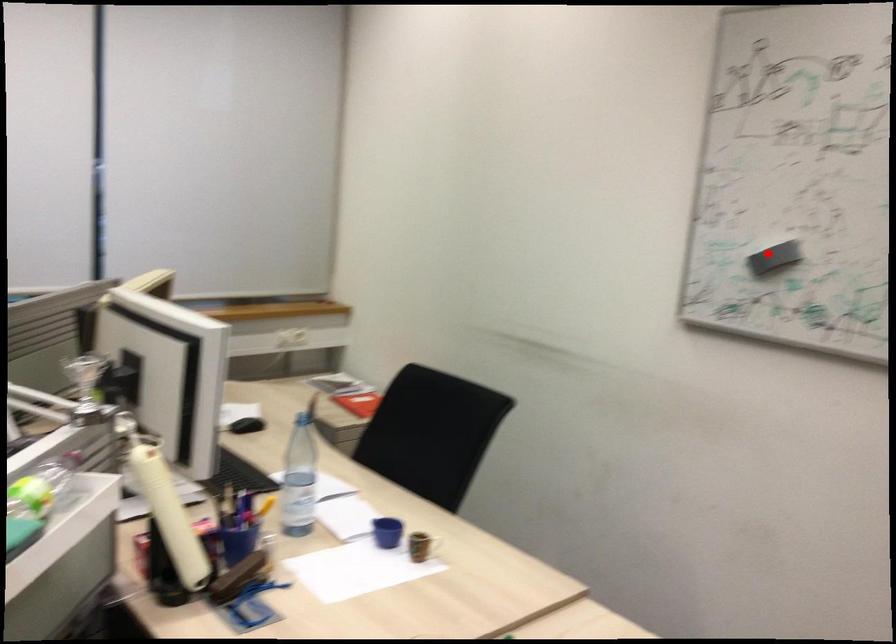
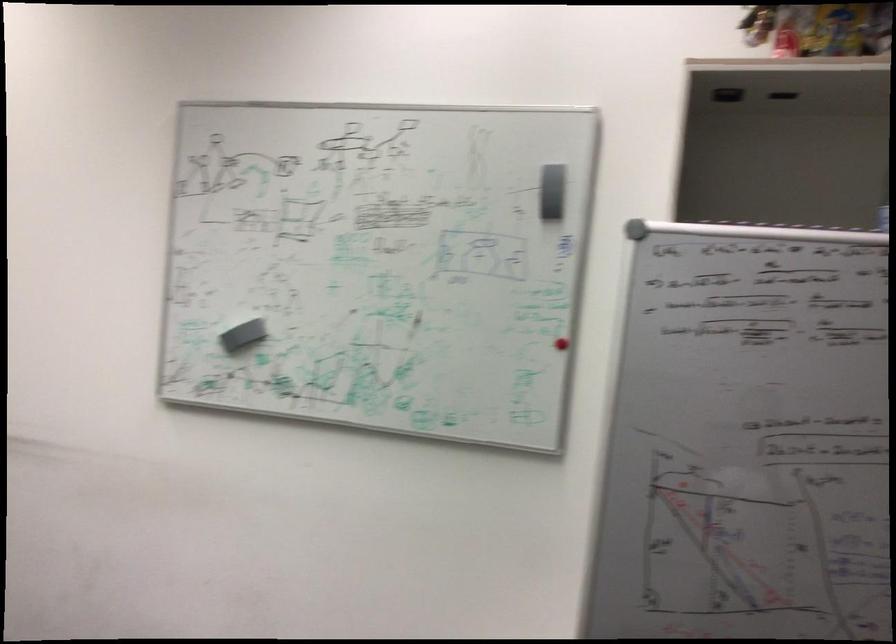
Question: I am providing you with two images of the same scene from different viewpoints. A red point is shown in image1. For the corresponding object point in image2, is it positioned nearer or farther from the camera?

Choices:
 (A) Nearer
 (B) Farther

Answer: (B)